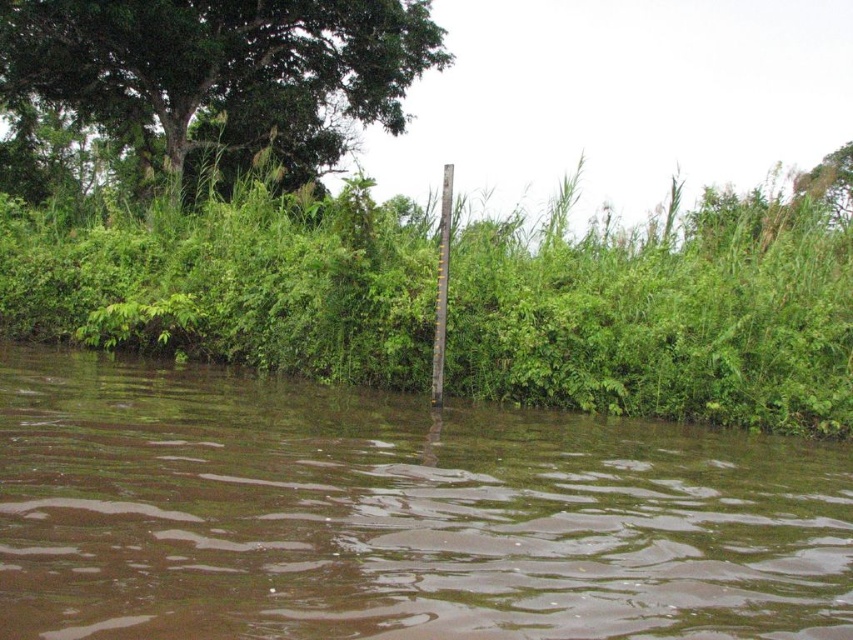
Question: Is brown muddy water at center to the right of green leafy vegetation at center from the viewer's perspective?

Choices:
 (A) no
 (B) yes

Answer: (B)

Question: Which object is farther from the camera taking this photo?

Choices:
 (A) green leafy tree at upper left
 (B) green leafy vegetation at center
 (C) brown muddy water at center

Answer: (A)

Question: Which object is farther from the camera taking this photo?

Choices:
 (A) brown muddy water at center
 (B) green leafy tree at upper left
 (C) green leafy vegetation at center

Answer: (B)

Question: Does brown muddy water at center appear under green leafy vegetation at center?

Choices:
 (A) no
 (B) yes

Answer: (B)

Question: Among these points, which one is farthest from the camera?

Choices:
 (A) (91, 260)
 (B) (627, 547)
 (C) (193, 97)

Answer: (C)

Question: Can you confirm if brown muddy water at center is smaller than green leafy vegetation at center?

Choices:
 (A) no
 (B) yes

Answer: (B)